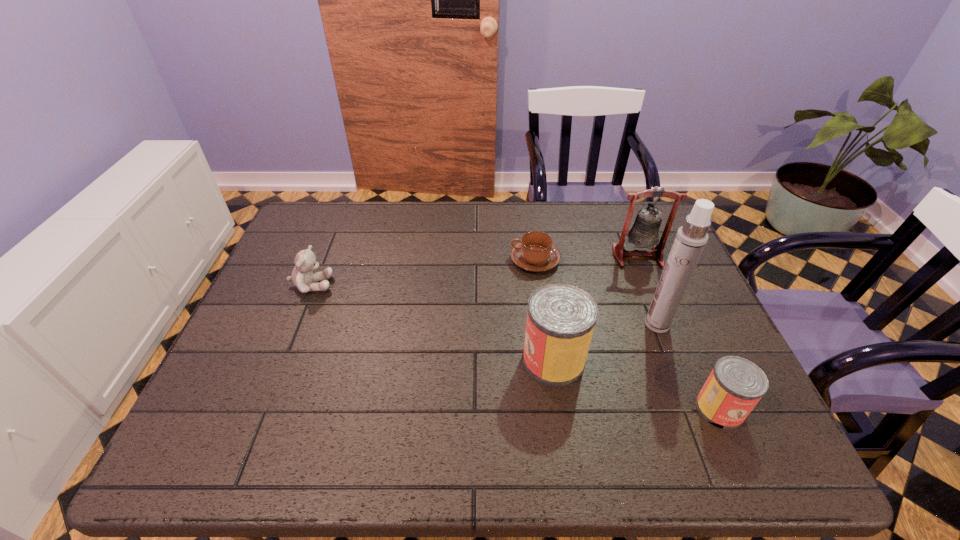
At what (x,y) coordinates should I click in order to perform the action: click on can located in the right edge section of the desktop. Please return your answer as a coordinate pair (x, y). The width and height of the screenshot is (960, 540). Looking at the image, I should click on (734, 387).

Locate an element on the screen. bell located in the right edge section of the desktop is located at coordinates (644, 233).

This screenshot has height=540, width=960. Find the location of `aerosol can present at the right edge`. aerosol can present at the right edge is located at coordinates (691, 238).

Where is `object that is at the far right corner`? object that is at the far right corner is located at coordinates (644, 233).

Identify the location of object present at the near right corner. This screenshot has width=960, height=540. (734, 387).

At what (x,y) coordinates should I click in order to perform the action: click on vacant space at the far edge of the desktop. Please return your answer as a coordinate pair (x, y). Looking at the image, I should click on (423, 207).

Locate an element on the screen. The height and width of the screenshot is (540, 960). free space at the near edge of the desktop is located at coordinates (329, 418).

Locate an element on the screen. This screenshot has width=960, height=540. vacant space at the left edge of the desktop is located at coordinates (268, 368).

This screenshot has height=540, width=960. Identify the location of free space at the right edge. (659, 340).

The image size is (960, 540). What are the coordinates of `vacant space at the far left corner of the desktop` in the screenshot? It's located at (345, 231).